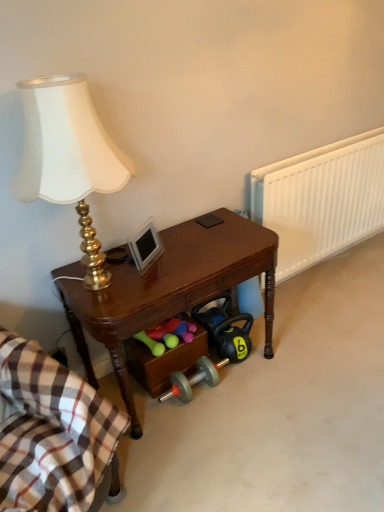
I want to click on free location above shiny brown desk at center (from a real-world perspective), so click(x=188, y=246).